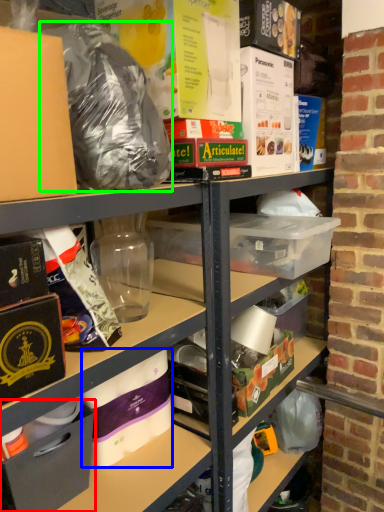
Question: Estimate the real-world distances between objects in this image. Which object is farther from box (highlighted by a red box), toilet paper (highlighted by a blue box) or waste (highlighted by a green box)?

Choices:
 (A) toilet paper
 (B) waste

Answer: (B)